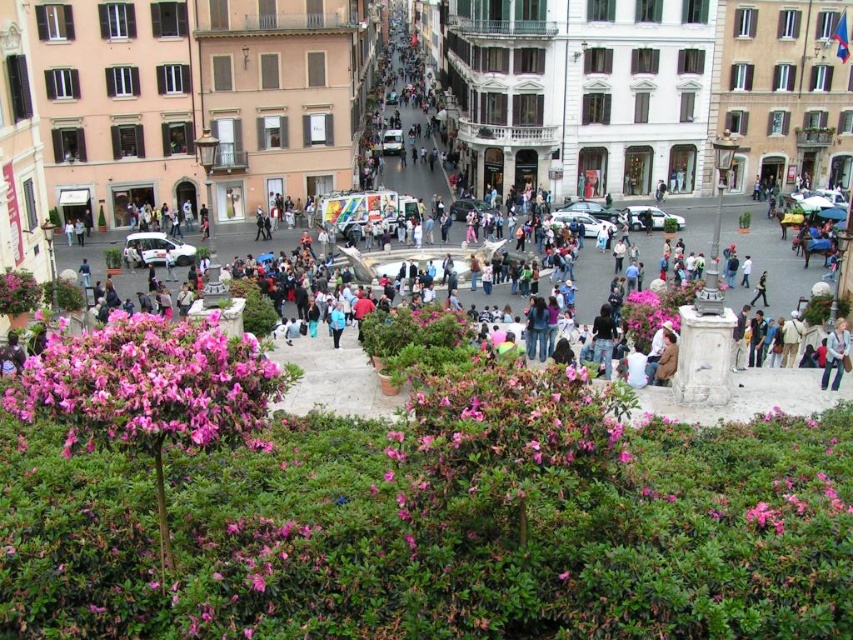
You are a photographer standing in the square and see the pink glossy bush at lower left and the blue denim jeans at lower right. Which object is closer to you?

The pink glossy bush at lower left is closer to you because it is positioned over the blue denim jeans at lower right, indicating it is in front.

You are a photographer planning to capture a wide shot of the square while ensuring both the pink glossy bush at lower left and the blue denim jeans at lower right are visible. Given their sizes, which object might require more careful framing to include fully in the shot?

The pink glossy bush at lower left has a larger width than the blue denim jeans at lower right, so it might require more careful framing to ensure it is fully included in the shot.